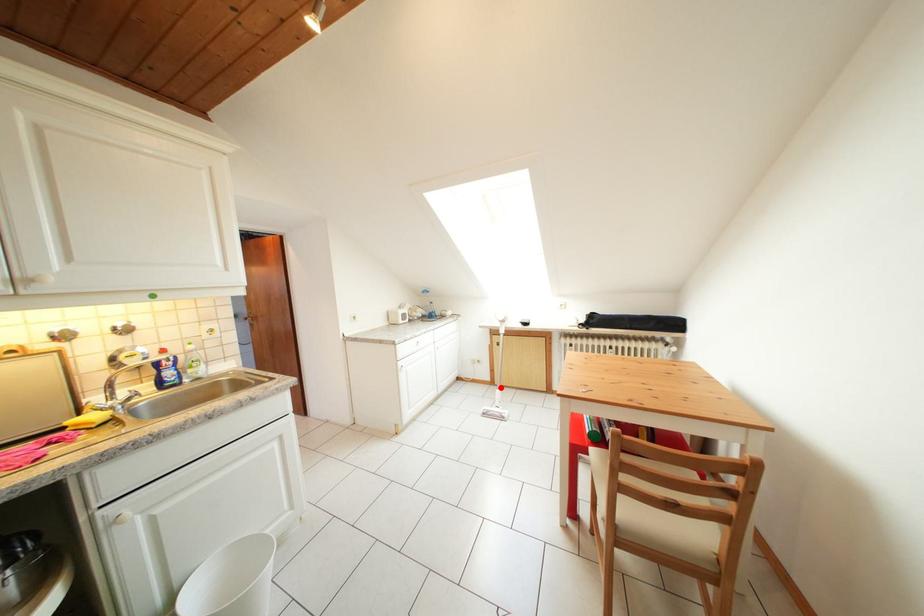
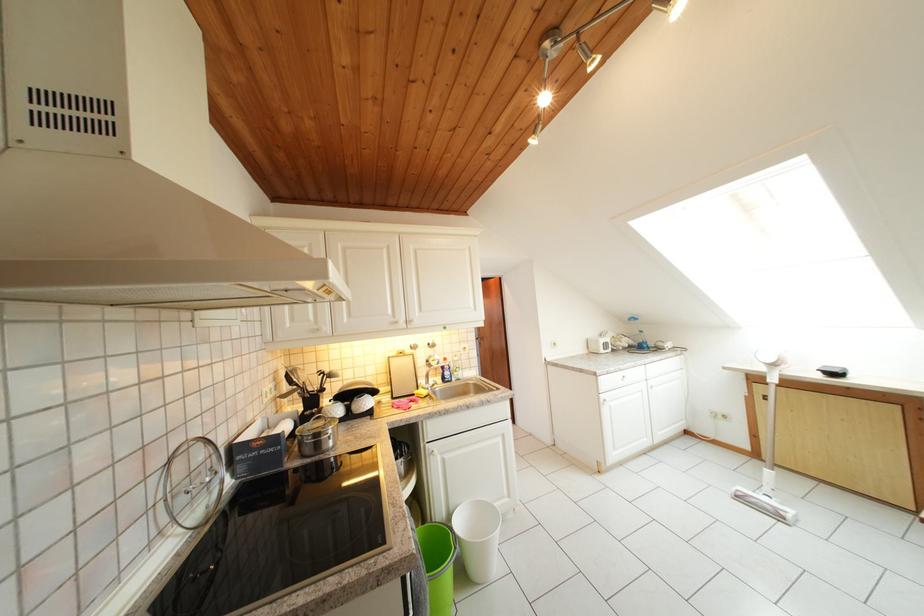
Where in the second image is the point corresponding to the highlighted location from the first image?

(764, 460)